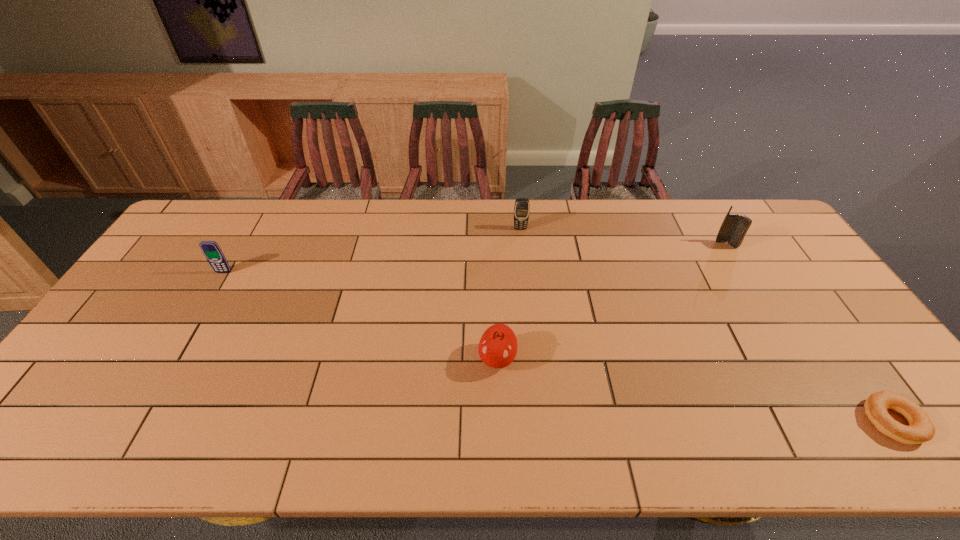
Locate an element on the screen. The width and height of the screenshot is (960, 540). vacant area that lies between the nearest object and the third object from left to right is located at coordinates (706, 325).

This screenshot has width=960, height=540. What are the coordinates of `unoccupied position between the farthest object and the rightmost object` in the screenshot? It's located at (706, 325).

Find the location of a particular element. Image resolution: width=960 pixels, height=540 pixels. object that can be found as the third closest to the nearest object is located at coordinates (522, 206).

Where is `the third closest object to the third object from right to left`? The height and width of the screenshot is (540, 960). the third closest object to the third object from right to left is located at coordinates (214, 255).

Identify which cellular telephone is the second closest to the leftmost object. Please provide its 2D coordinates. Your answer should be formatted as a tuple, i.e. [(x, y)], where the tuple contains the x and y coordinates of a point satisfying the conditions above.

[(734, 227)]

Select which cellular telephone is the closest to the third farthest object. Please provide its 2D coordinates. Your answer should be formatted as a tuple, i.e. [(x, y)], where the tuple contains the x and y coordinates of a point satisfying the conditions above.

[(522, 206)]

I want to click on free space that satisfies the following two spatial constraints: 1. on the front-facing side of the leftmost object; 2. on the right side of the apple, so click(x=173, y=359).

I want to click on vacant space that satisfies the following two spatial constraints: 1. on the keyboard of the bagel; 2. on the left side of the tallest object, so click(833, 421).

Find the location of a particular element. vacant space that satisfies the following two spatial constraints: 1. on the front-facing side of the second object from left to right; 2. on the right side of the leftmost object is located at coordinates (173, 359).